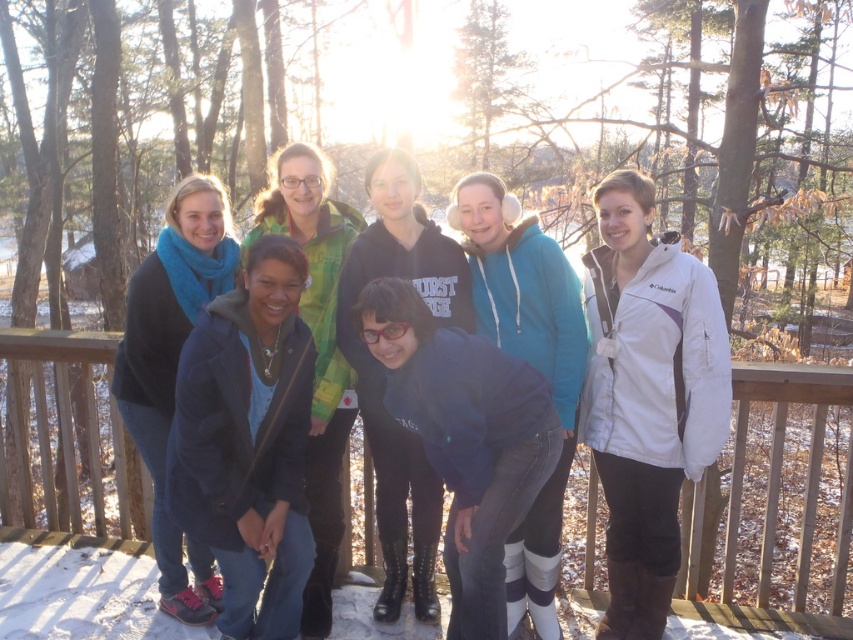
Is wooden deck at center positioned in front of dark blue hoodie at center?

No, wooden deck at center is behind dark blue hoodie at center.

Does wooden deck at center appear on the left side of dark blue hoodie at center?

Incorrect, wooden deck at center is not on the left side of dark blue hoodie at center.

Describe the element at coordinates (782, 506) in the screenshot. I see `wooden deck at center` at that location.

The width and height of the screenshot is (853, 640). What are the coordinates of `wooden deck at center` in the screenshot? It's located at (782, 506).

Can you confirm if dark blue fleece at center is thinner than dark blue hoodie at center?

Incorrect, dark blue fleece at center's width is not less than dark blue hoodie at center's.

Which of these two, dark blue fleece at center or dark blue hoodie at center, stands shorter?

Standing shorter between the two is dark blue fleece at center.

This screenshot has width=853, height=640. What do you see at coordinates (463, 436) in the screenshot?
I see `dark blue fleece at center` at bounding box center [463, 436].

Locate an element on the screen. dark blue fleece at center is located at coordinates (463, 436).

In the scene shown: Is navy blue jacket at center smaller than dark blue fleece at center?

Yes, navy blue jacket at center is smaller than dark blue fleece at center.

How far apart are navy blue jacket at center and dark blue fleece at center?

navy blue jacket at center is 24.01 inches from dark blue fleece at center.

Where is `navy blue jacket at center`? The width and height of the screenshot is (853, 640). navy blue jacket at center is located at coordinates (248, 442).

You are a GUI agent. You are given a task and a screenshot of the screen. Output one action in this format:
    pyautogui.click(x=<x>, y=<y>)
    Task: Click on the navy blue jacket at center
    This screenshot has height=640, width=853.
    Given the screenshot: What is the action you would take?
    pyautogui.click(x=248, y=442)